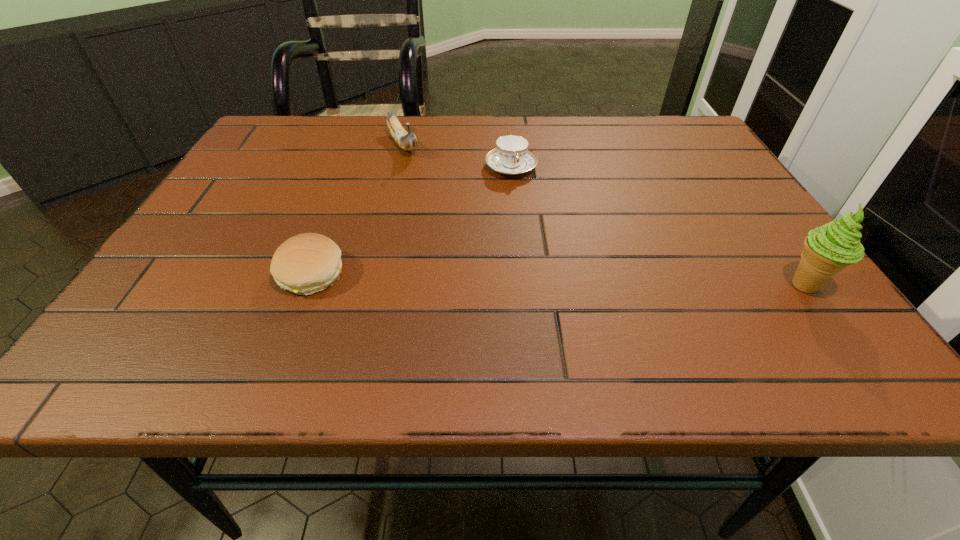
You are a GUI agent. You are given a task and a screenshot of the screen. Output one action in this format:
    pyautogui.click(x=<x>, y=<y>)
    Task: Click on the free spot on the desktop that is between the leftmost object and the icecream and is positioned at the stem of the second object from left to right
    The height and width of the screenshot is (540, 960).
    Given the screenshot: What is the action you would take?
    pyautogui.click(x=499, y=278)

The height and width of the screenshot is (540, 960). In order to click on vacant space on the desktop that is between the patty and the icecream and is positioned on the side with the handle of the teacup in this screenshot , I will do `click(563, 280)`.